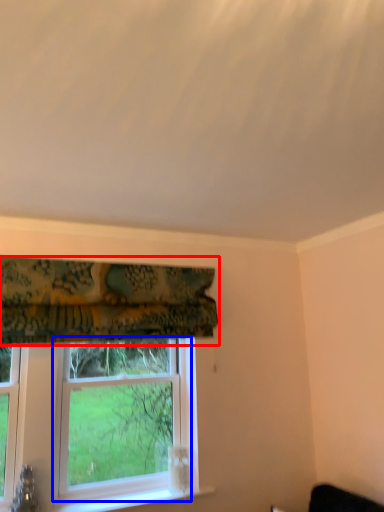
Question: Which object appears closest to the camera in this image, curtain (highlighted by a red box) or window (highlighted by a blue box)?

Choices:
 (A) curtain
 (B) window

Answer: (A)